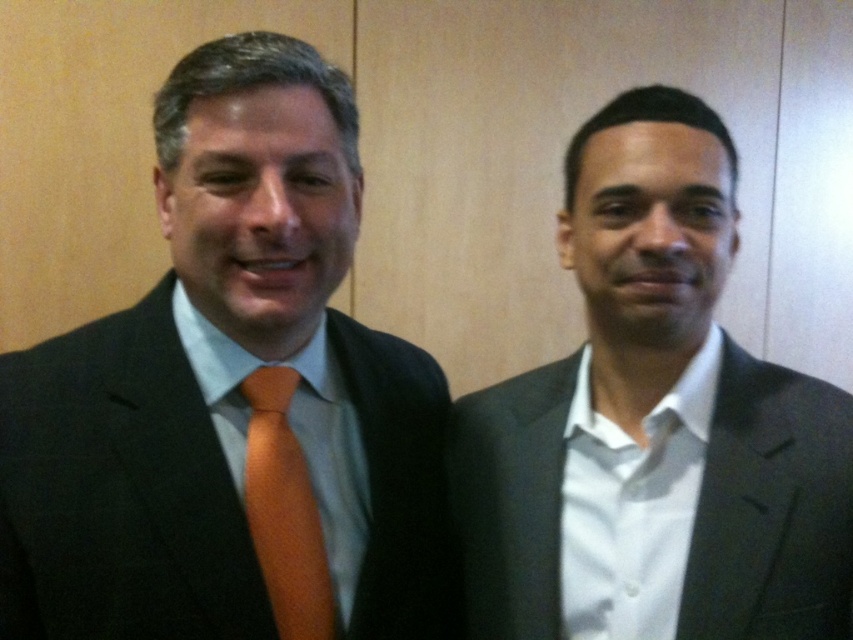
The width and height of the screenshot is (853, 640). What do you see at coordinates (231, 400) in the screenshot? I see `matte black suit at left` at bounding box center [231, 400].

Is point (56, 412) positioned behind point (669, 604)?

No, (56, 412) is closer to viewer.

At what (x,y) coordinates should I click in order to perform the action: click on matte black suit at left. Please return your answer as a coordinate pair (x, y). Looking at the image, I should click on (231, 400).

Is matte black suit at left to the right of orange satin tie at left from the viewer's perspective?

No, matte black suit at left is not to the right of orange satin tie at left.

Is matte black suit at left further to camera compared to orange satin tie at left?

No, matte black suit at left is closer to the viewer.

Find the location of a particular element. The height and width of the screenshot is (640, 853). matte black suit at left is located at coordinates pyautogui.click(x=231, y=400).

What are the coordinates of `matte black suit at left` in the screenshot? It's located at (231, 400).

From the picture: Does matte black suit at right appear on the left side of orange satin tie at left?

Incorrect, matte black suit at right is not on the left side of orange satin tie at left.

Is matte black suit at right thinner than orange satin tie at left?

In fact, matte black suit at right might be wider than orange satin tie at left.

Locate an element on the screen. Image resolution: width=853 pixels, height=640 pixels. matte black suit at right is located at coordinates (654, 413).

The height and width of the screenshot is (640, 853). In order to click on matte black suit at right in this screenshot , I will do `click(654, 413)`.